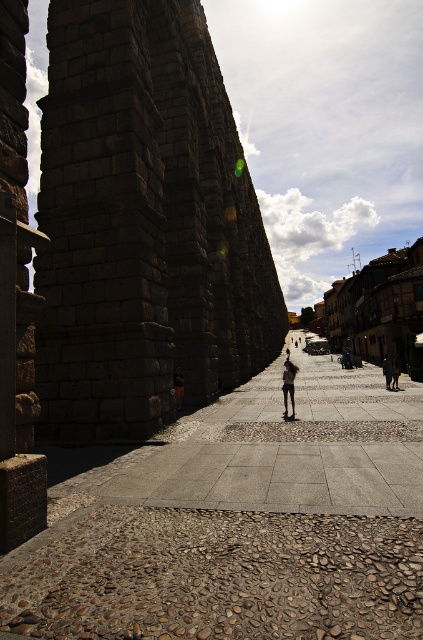
Question: Which point is farther from the camera taking this photo?

Choices:
 (A) (296, 451)
 (B) (293, 381)

Answer: (B)

Question: Among these objects, which one is farthest from the camera?

Choices:
 (A) dark blue jeans at center
 (B) brown stone alley at center

Answer: (A)

Question: Is brown stone alley at center positioned at the back of dark blue jeans at center?

Choices:
 (A) no
 (B) yes

Answer: (A)

Question: Can you confirm if brown stone alley at center is positioned above dark blue jeans at center?

Choices:
 (A) yes
 (B) no

Answer: (B)

Question: Is brown stone alley at center positioned before dark blue jeans at center?

Choices:
 (A) yes
 (B) no

Answer: (A)